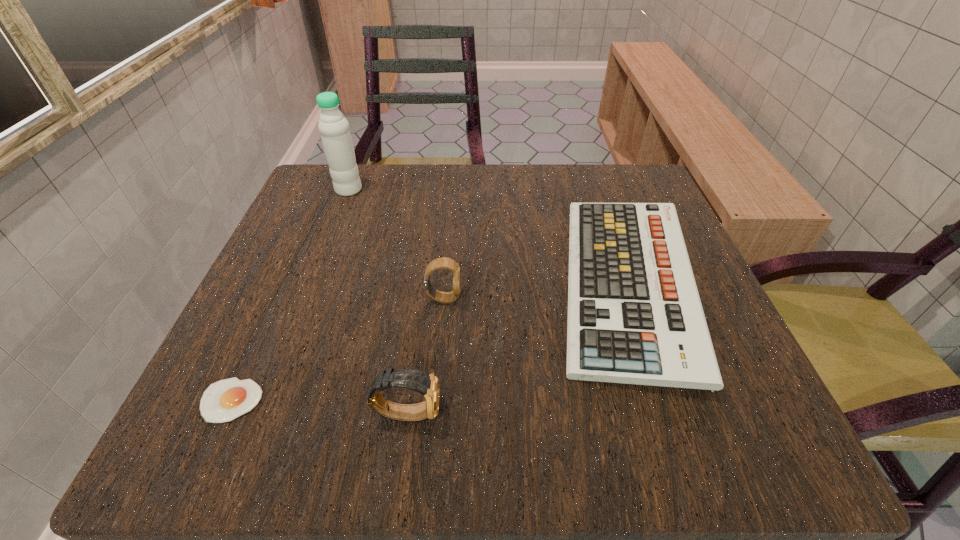
Identify the location of object that is at the far left corner. (334, 128).

Image resolution: width=960 pixels, height=540 pixels. What are the coordinates of `object that is at the near left corner` in the screenshot? It's located at (225, 400).

I want to click on object at the far right corner, so click(x=634, y=313).

The width and height of the screenshot is (960, 540). Identify the location of object present at the near right corner. (634, 313).

At what (x,y) coordinates should I click in order to perform the action: click on free space at the far edge. Please return your answer as a coordinate pair (x, y). Looking at the image, I should click on (460, 184).

The height and width of the screenshot is (540, 960). In the image, there is a desktop. In order to click on free space at the near edge in this screenshot , I will do `click(607, 435)`.

Image resolution: width=960 pixels, height=540 pixels. I want to click on free space at the left edge of the desktop, so click(x=325, y=288).

The height and width of the screenshot is (540, 960). I want to click on vacant region at the right edge of the desktop, so click(681, 395).

Find the location of a particular element. Image resolution: width=960 pixels, height=540 pixels. free space at the far left corner is located at coordinates (359, 176).

In the image, there is a desktop. Where is `vacant space at the near left corner`? vacant space at the near left corner is located at coordinates (192, 404).